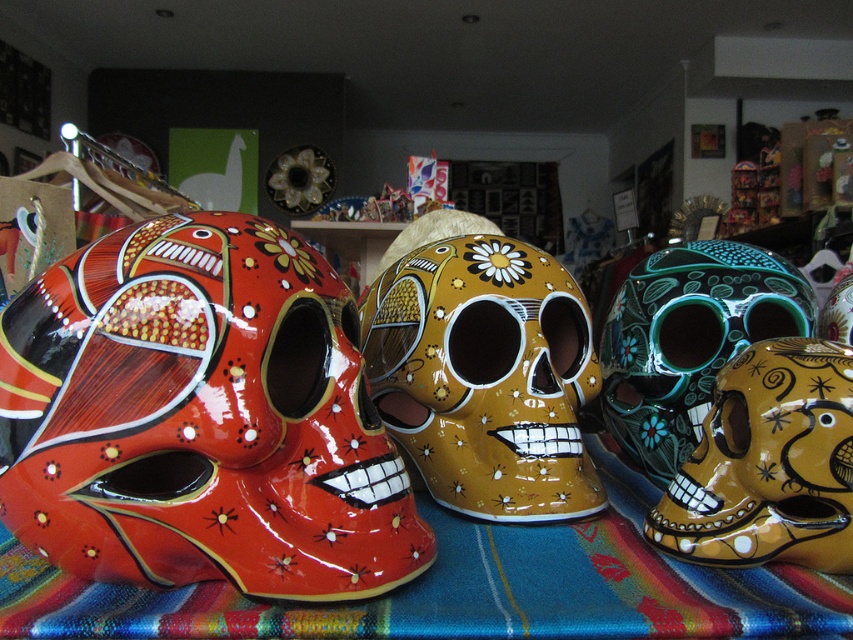
Can you confirm if textured woven cloth at center is bigger than glossy ceramic skull at center?

Yes, textured woven cloth at center is bigger than glossy ceramic skull at center.

This screenshot has height=640, width=853. What do you see at coordinates (466, 588) in the screenshot? I see `textured woven cloth at center` at bounding box center [466, 588].

This screenshot has width=853, height=640. Identify the location of textured woven cloth at center. (466, 588).

Can you confirm if glossy ceramic skull at left is positioned above glossy ceramic skull at center?

Correct, glossy ceramic skull at left is located above glossy ceramic skull at center.

Does glossy ceramic skull at left have a greater width compared to glossy ceramic skull at center?

Indeed, glossy ceramic skull at left has a greater width compared to glossy ceramic skull at center.

Is point (305, 394) farther from viewer compared to point (764, 419)?

That is True.

You are a GUI agent. You are given a task and a screenshot of the screen. Output one action in this format:
    pyautogui.click(x=<x>, y=<y>)
    Task: Click on the glossy ceramic skull at left
    
    Given the screenshot: What is the action you would take?
    pyautogui.click(x=201, y=417)

Can you confirm if glossy ceramic skull at center is smaller than green glossy skull at center right?

Yes, glossy ceramic skull at center is smaller than green glossy skull at center right.

Which is behind, point (746, 502) or point (619, 435)?

The point (619, 435) is more distant.

Where is `glossy ceramic skull at center`? glossy ceramic skull at center is located at coordinates (769, 464).